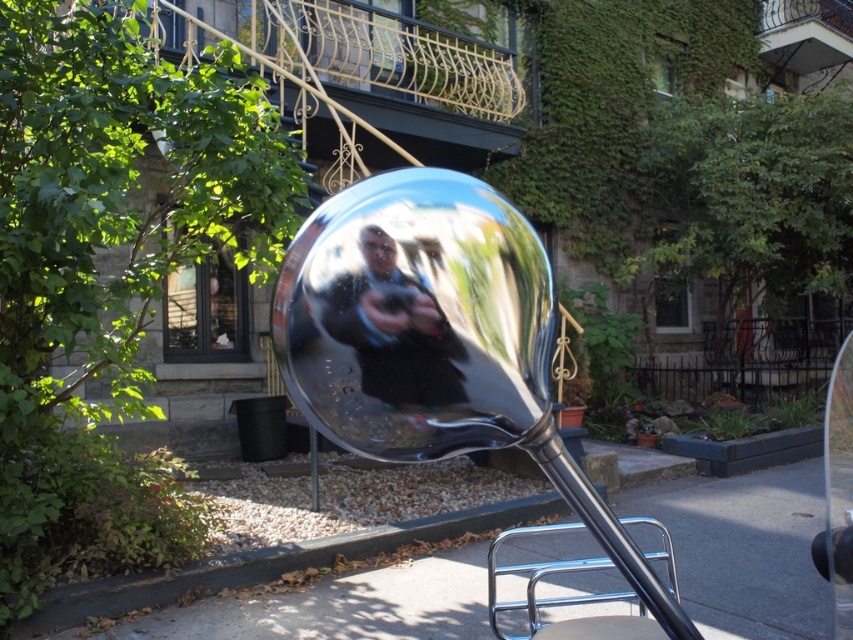
Can you confirm if chrome metallic rearview mirror at center is wider than smooth concrete pavement at lower center?

No.

Measure the distance between point (485, 282) and camera.

1.03 meters

Is point (392, 456) positioned before point (746, 624)?

That is True.

Locate an element on the screen. This screenshot has width=853, height=640. chrome metallic rearview mirror at center is located at coordinates (440, 348).

Can you confirm if chrome metallic rearview mirror at center is shorter than shiny metallic sphere at center?

Incorrect, chrome metallic rearview mirror at center's height does not fall short of shiny metallic sphere at center's.

Does chrome metallic rearview mirror at center have a greater height compared to shiny metallic sphere at center?

Yes.

Between point (273, 312) and point (390, 323), which one is positioned behind?

Point (273, 312)

Image resolution: width=853 pixels, height=640 pixels. Identify the location of chrome metallic rearview mirror at center. (440, 348).

Who is more forward, (x=399, y=632) or (x=421, y=394)?

Point (x=421, y=394)

Does smooth concrete pavement at lower center have a smaller size compared to shiny metallic sphere at center?

Actually, smooth concrete pavement at lower center might be larger than shiny metallic sphere at center.

Consider the image. Who is more forward, (764,474) or (395,284)?

Point (395,284) is in front.

At what (x,y) coordinates should I click in order to perform the action: click on smooth concrete pavement at lower center. Please return your answer as a coordinate pair (x, y). Looking at the image, I should click on (746, 550).